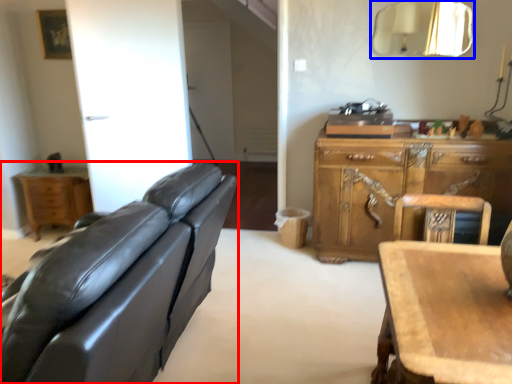
Question: Among these objects, which one is nearest to the camera, studio couch (highlighted by a red box) or mirror (highlighted by a blue box)?

Choices:
 (A) studio couch
 (B) mirror

Answer: (A)